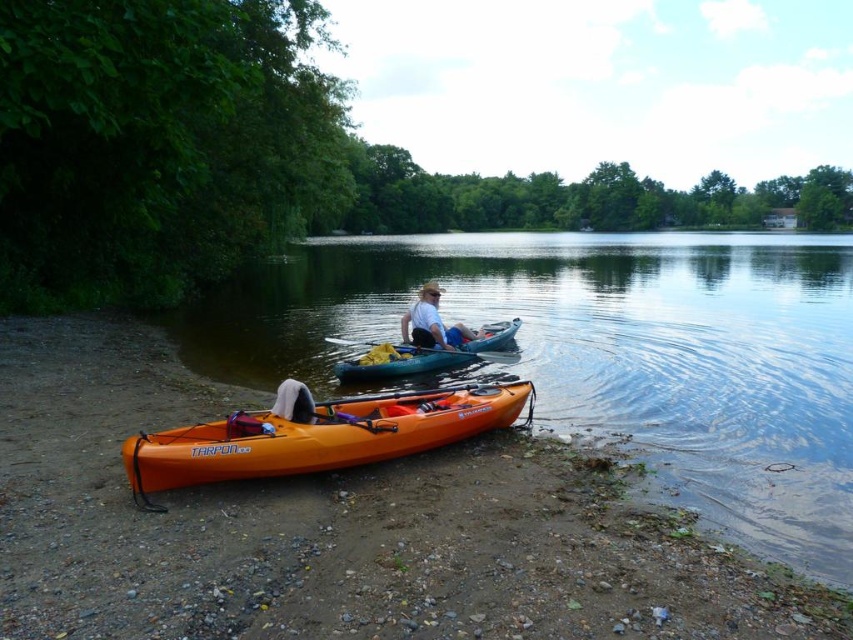
Is teal rubber kayak at center shorter than matte white shirt at center?

Correct, teal rubber kayak at center is not as tall as matte white shirt at center.

Who is positioned more to the right, teal rubber kayak at center or matte white shirt at center?

matte white shirt at center is more to the right.

Is point (498, 330) positioned before point (428, 292)?

No.

You are a GUI agent. You are given a task and a screenshot of the screen. Output one action in this format:
    pyautogui.click(x=<x>, y=<y>)
    Task: Click on the teal rubber kayak at center
    
    Given the screenshot: What is the action you would take?
    pyautogui.click(x=428, y=355)

Does orange matte kayak at lower left have a larger size compared to teal rubber kayak at center?

Correct, orange matte kayak at lower left is larger in size than teal rubber kayak at center.

Is point (337, 449) closer to viewer compared to point (408, 365)?

Yes.

This screenshot has width=853, height=640. Identify the location of orange matte kayak at lower left. (318, 435).

Does point (344, 364) come in front of point (372, 342)?

Yes, point (344, 364) is closer to viewer.

Can you confirm if teal rubber kayak at center is positioned to the left of wooden paddle at center?

Correct, you'll find teal rubber kayak at center to the left of wooden paddle at center.

Does point (364, 365) come closer to viewer compared to point (497, 355)?

Yes, point (364, 365) is in front of point (497, 355).

Where is `teal rubber kayak at center`? Image resolution: width=853 pixels, height=640 pixels. teal rubber kayak at center is located at coordinates (428, 355).